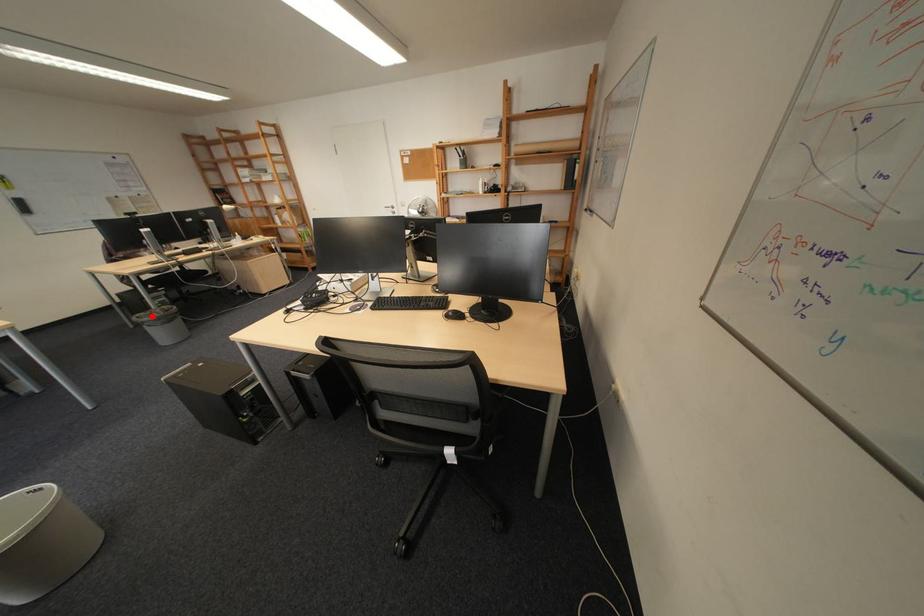
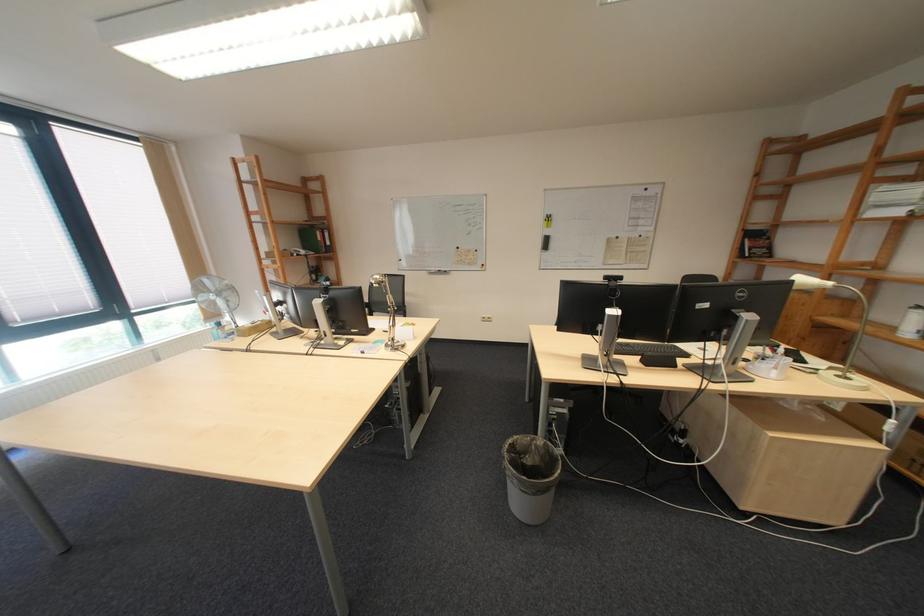
Find the pixel in the second image that matches the highlighted location in the first image.

(529, 439)